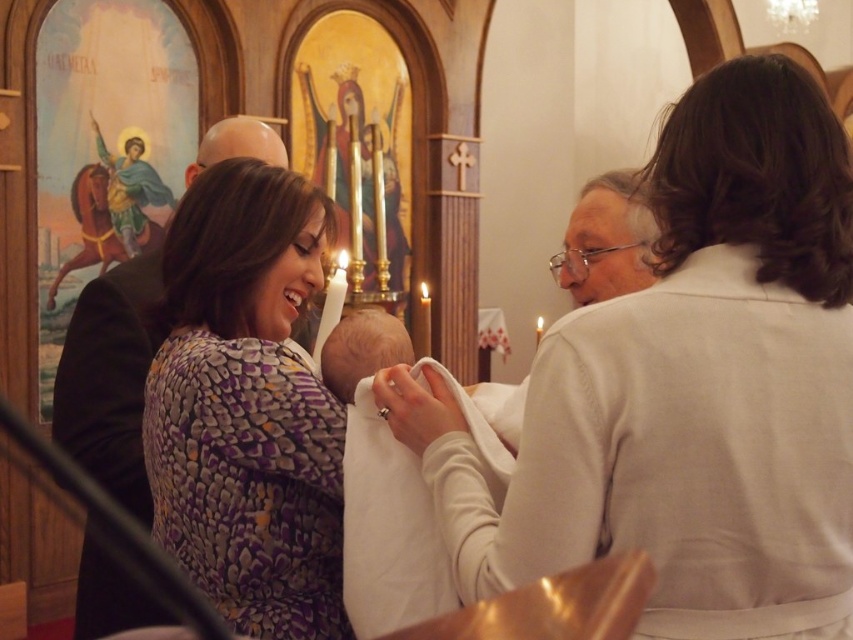
Question: Does purple printed dress at center appear over dark brown leather jacket at left?

Choices:
 (A) yes
 (B) no

Answer: (B)

Question: Which object is farther from the camera taking this photo?

Choices:
 (A) white matte shirt at upper right
 (B) purple printed dress at center
 (C) dark brown leather jacket at left

Answer: (C)

Question: Is the position of white matte shirt at upper right more distant than that of purple printed dress at center?

Choices:
 (A) yes
 (B) no

Answer: (B)

Question: Which point is farther to the camera?

Choices:
 (A) white matte shirt at upper right
 (B) dark brown leather jacket at left

Answer: (B)

Question: In this image, where is white matte shirt at upper right located relative to dark brown leather jacket at left?

Choices:
 (A) above
 (B) below

Answer: (A)

Question: Among these objects, which one is farthest from the camera?

Choices:
 (A) dark brown leather jacket at left
 (B) white matte shirt at upper right
 (C) purple printed dress at center

Answer: (A)